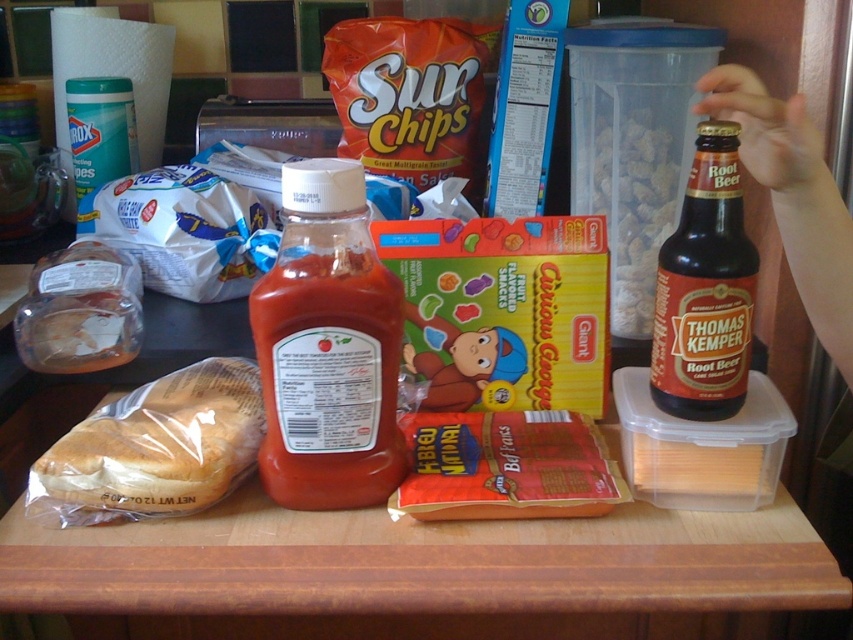
You are a food safety inspector checking the height of the sandwiches to ensure proper storage. Which sandwich, the translucent plastic sandwich at center left or the translucent plastic sandwich at left, is shorter?

The translucent plastic sandwich at center left is shorter than the translucent plastic sandwich at left.

You are a food delivery robot with a height of 1 meter. You need to pick up the translucent plastic sandwich at center left from the counter. Can you reach it?

The distance of translucent plastic sandwich at center left from viewer is 55.06 centimeters. Since the robot is 1 meter tall, it can easily reach the sandwich as the distance is within its operational range.